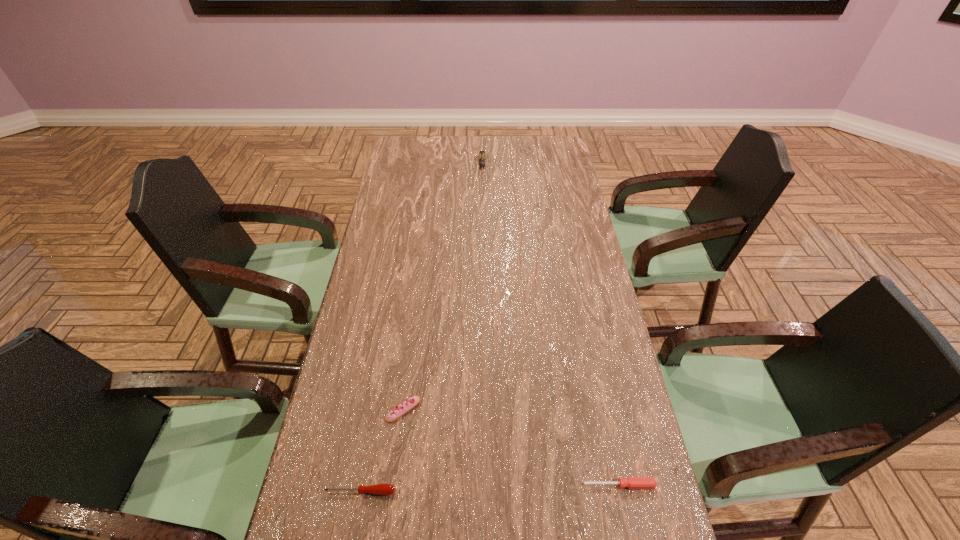
Where is `free space between the rightmost screwdriver and the eclair`? Image resolution: width=960 pixels, height=540 pixels. free space between the rightmost screwdriver and the eclair is located at coordinates (512, 447).

Find the location of a particular element. Image resolution: width=960 pixels, height=540 pixels. vacant space that is in between the rightmost screwdriver and the eclair is located at coordinates (512, 447).

This screenshot has height=540, width=960. What are the coordinates of `unoccupied area between the eclair and the second screwdriver from left to right` in the screenshot? It's located at (443, 288).

Find the location of a particular element. Image resolution: width=960 pixels, height=540 pixels. vacant area that lies between the leftmost screwdriver and the third nearest object is located at coordinates (382, 450).

Find the location of a particular element. The height and width of the screenshot is (540, 960). vacant region between the leftmost screwdriver and the second farthest object is located at coordinates (382, 450).

The height and width of the screenshot is (540, 960). I want to click on free point between the rightmost screwdriver and the second screwdriver from left to right, so click(x=551, y=326).

Locate an element on the screen. Image resolution: width=960 pixels, height=540 pixels. free area in between the farthest object and the rightmost screwdriver is located at coordinates (551, 326).

This screenshot has height=540, width=960. In order to click on the second closest object to the leftmost screwdriver in this screenshot , I will do `click(631, 482)`.

The height and width of the screenshot is (540, 960). I want to click on object that is the closest to the farthest object, so pyautogui.click(x=401, y=409).

Locate an element on the screen. The width and height of the screenshot is (960, 540). screwdriver that is the second closest to the eclair is located at coordinates (631, 482).